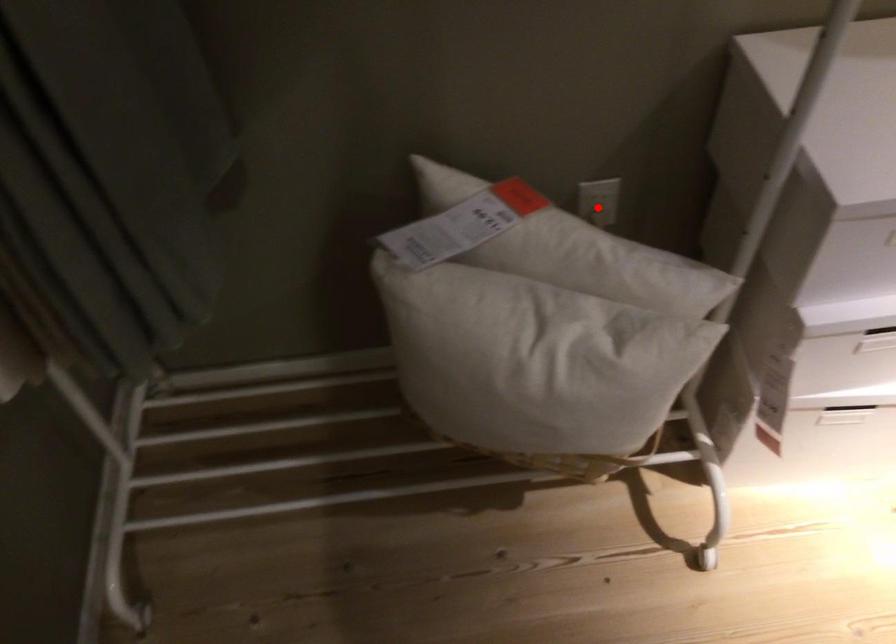
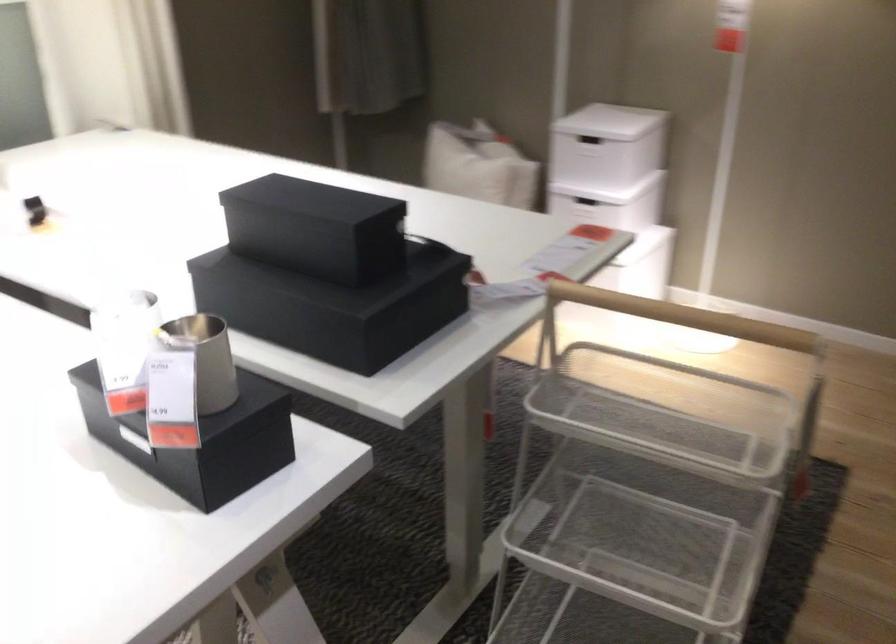
Question: I am providing you with two images of the same scene from different viewpoints. A red point is marked on the first image. At the location where the point appears in image 1, is it still visible in image 2?

Choices:
 (A) Yes
 (B) No

Answer: (B)